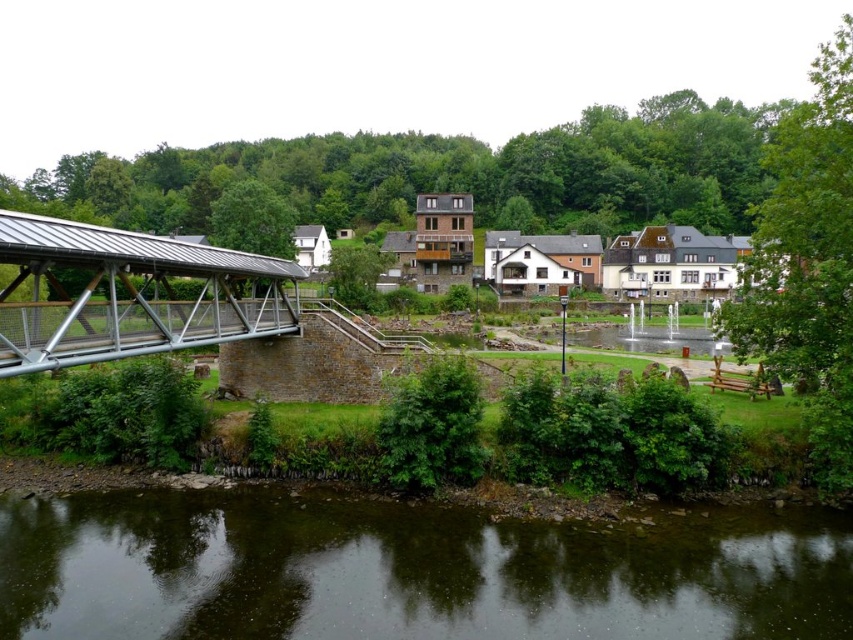
You are standing on the riverside and see the dark brown water at lower center and the metallic gray bridge at left. Which object is closer to the ground level?

The dark brown water at lower center is closer to the ground level because it is positioned below the metallic gray bridge at left.

You are standing at the point closer to the camera between the two points, point (84, 538) and point (68, 310). Which point are you standing at?

You are standing at point (84, 538) because it is further to the camera than point (68, 310).

You are standing on the riverside and want to cross to the other side. The metallic gray bridge at left is your only option. Can you see the dark brown water at lower center from the bridge?

Yes, because the dark brown water at lower center is not as tall as the metallic gray bridge at left, so the water is lower than the bridge, allowing visibility from the bridge.